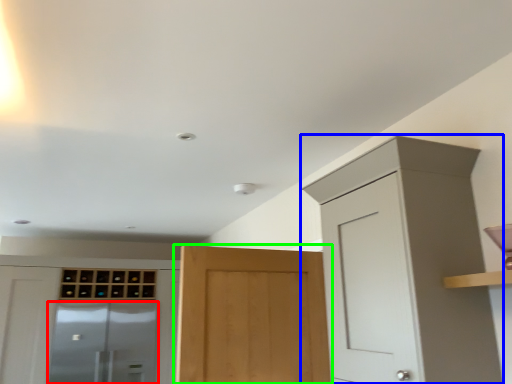
Question: Which object is the closest to the screen door (highlighted by a red box)? Choose among these: cabinetry (highlighted by a blue box) or door (highlighted by a green box).

Choices:
 (A) cabinetry
 (B) door

Answer: (B)